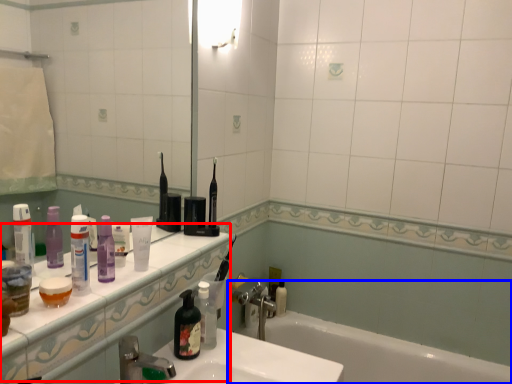
Question: Among these objects, which one is nearest to the camera, counter top (highlighted by a red box) or bathtub (highlighted by a blue box)?

Choices:
 (A) counter top
 (B) bathtub

Answer: (A)